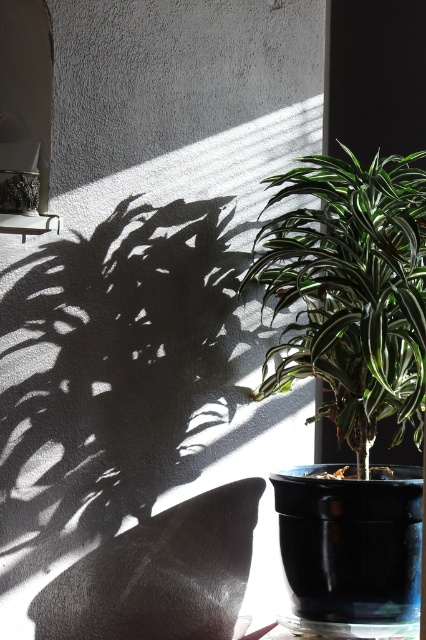
Between green glossy plant at center and metallic frame at upper left, which one is positioned lower?

green glossy plant at center is lower down.

Is green glossy plant at center shorter than metallic frame at upper left?

No.

Identify the location of green glossy plant at center. The width and height of the screenshot is (426, 640). (351, 291).

You are a GUI agent. You are given a task and a screenshot of the screen. Output one action in this format:
    pyautogui.click(x=<x>, y=<y>)
    Task: Click on the green glossy plant at center
    
    Given the screenshot: What is the action you would take?
    pyautogui.click(x=351, y=291)